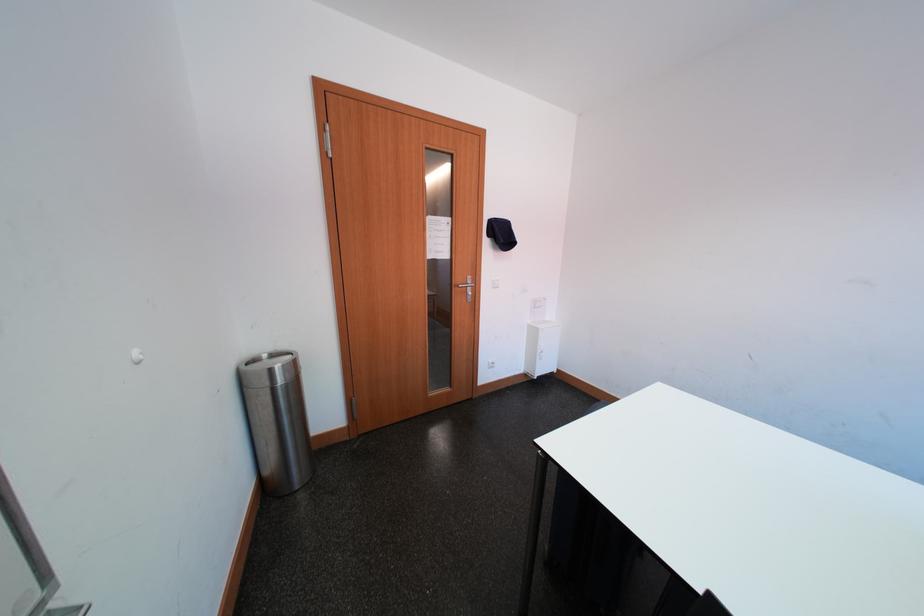
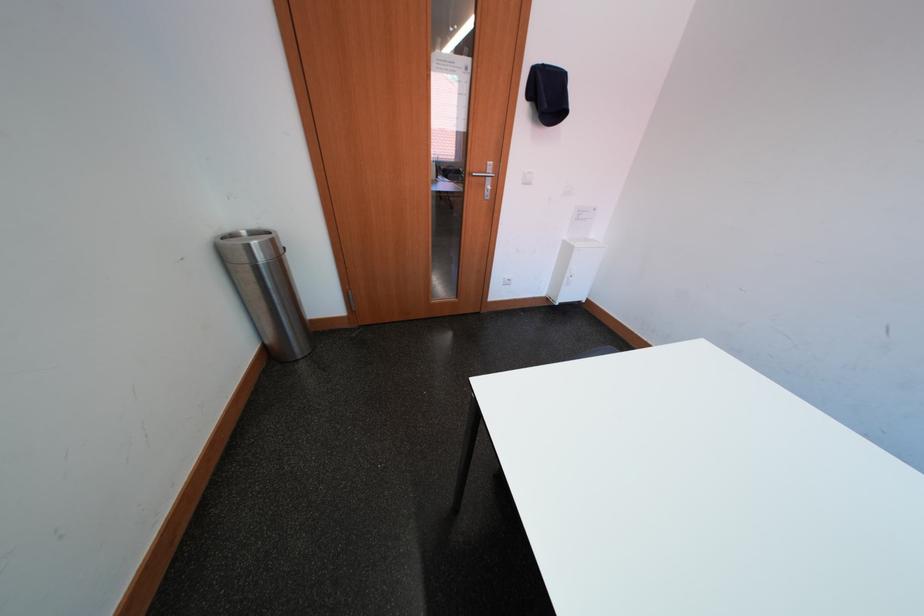
What movement of the cameraman would produce the second image?

The cameraman walked toward right, forward.